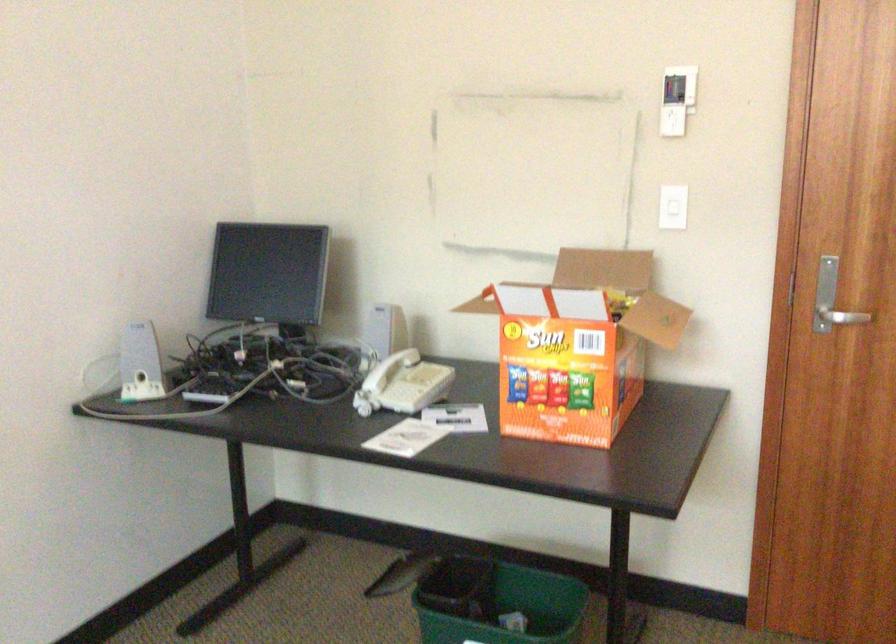
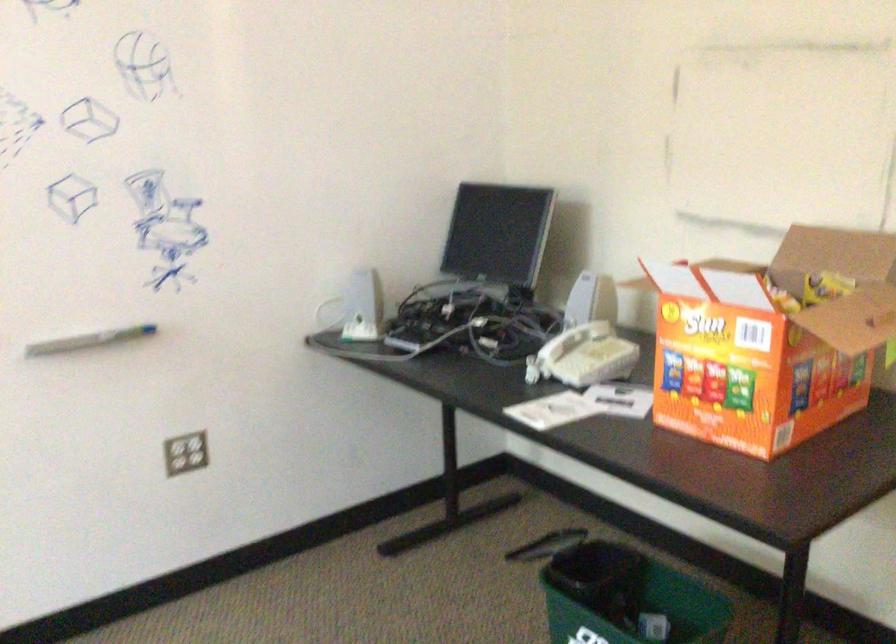
Question: The camera is either moving clockwise (left) or counter-clockwise (right) around the object. The first image is from the beginning of the video and the second image is from the end. Is the camera moving left or right when shooting the video?

Choices:
 (A) Left
 (B) Right

Answer: (B)